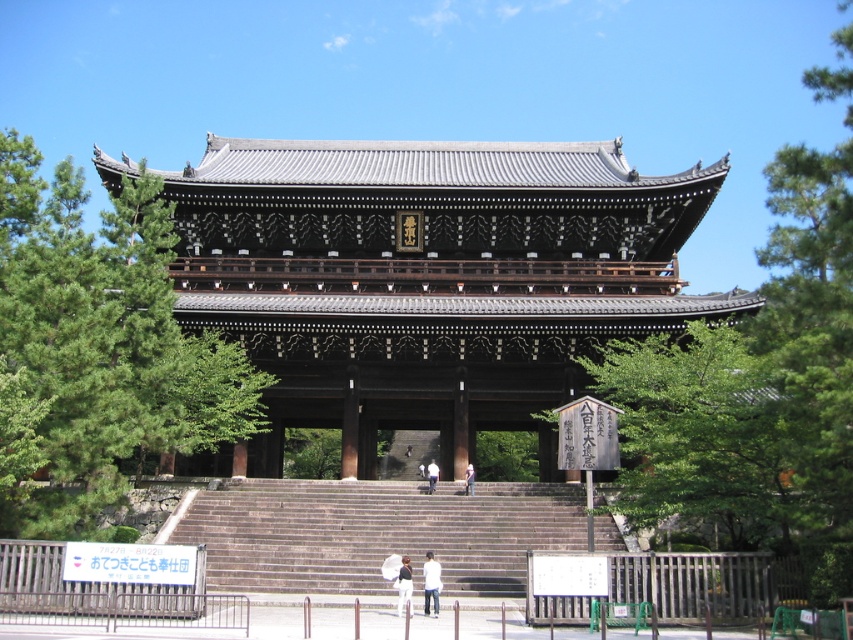
Looking at this image, who is positioned more to the left, green leafy tree at left or light brown wooden person at center?

From the viewer's perspective, green leafy tree at left appears more on the left side.

Between point (44, 493) and point (473, 470), which one is positioned in front?

Point (44, 493) is in front.

Locate an element on the screen. green leafy tree at left is located at coordinates (96, 349).

Is green leafy tree at upper right in front of white matte person at center?

Yes.

Who is lower down, green leafy tree at upper right or white matte person at center?

white matte person at center is below.

The image size is (853, 640). In order to click on green leafy tree at upper right in this screenshot , I will do coord(759,380).

Is wooden temple gate at center taller than white matte person at center?

Correct, wooden temple gate at center is much taller as white matte person at center.

Which is more to the left, wooden temple gate at center or white matte person at center?

From the viewer's perspective, wooden temple gate at center appears more on the left side.

What do you see at coordinates (428, 278) in the screenshot? I see `wooden temple gate at center` at bounding box center [428, 278].

I want to click on wooden temple gate at center, so click(428, 278).